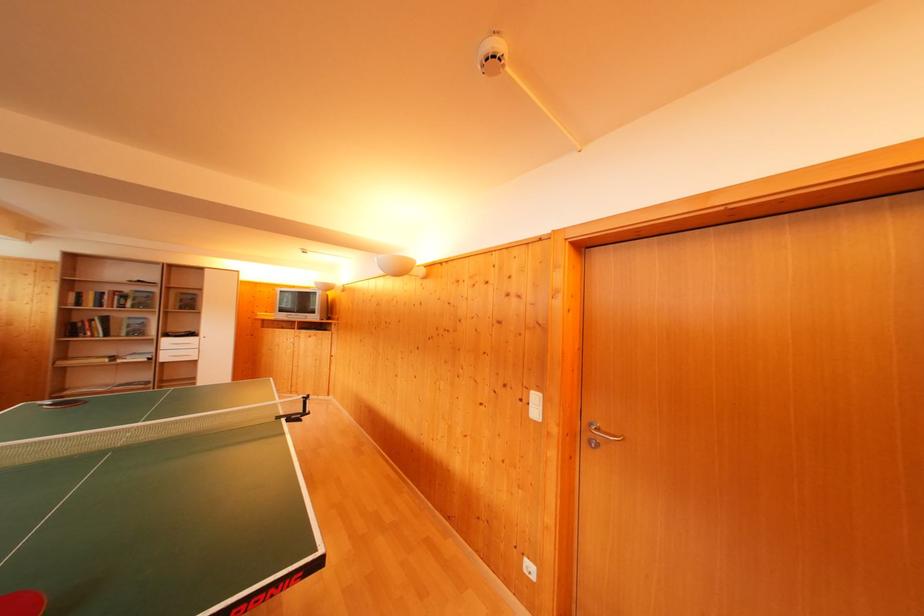
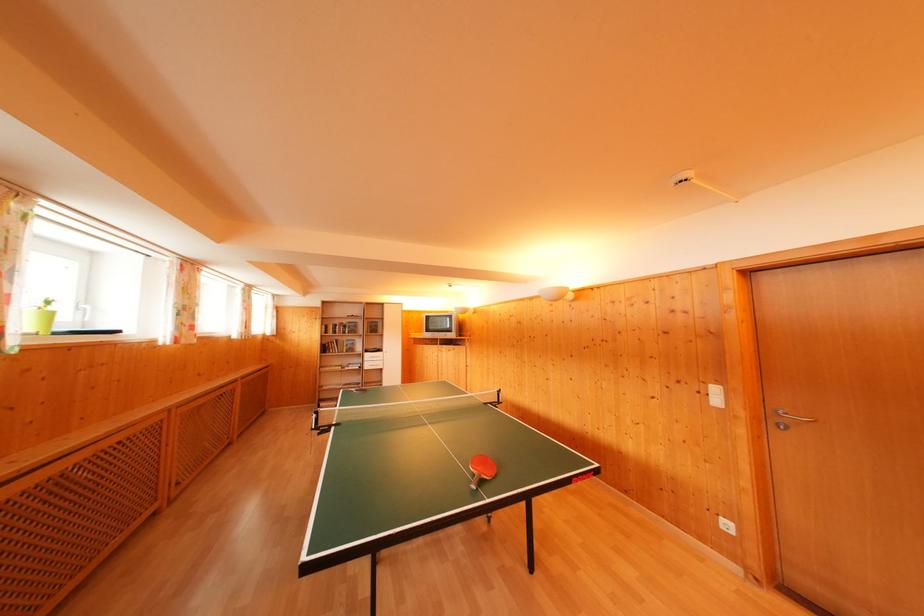
Where in the second image is the point corresponding to (x=131, y=294) from the first image?

(349, 326)